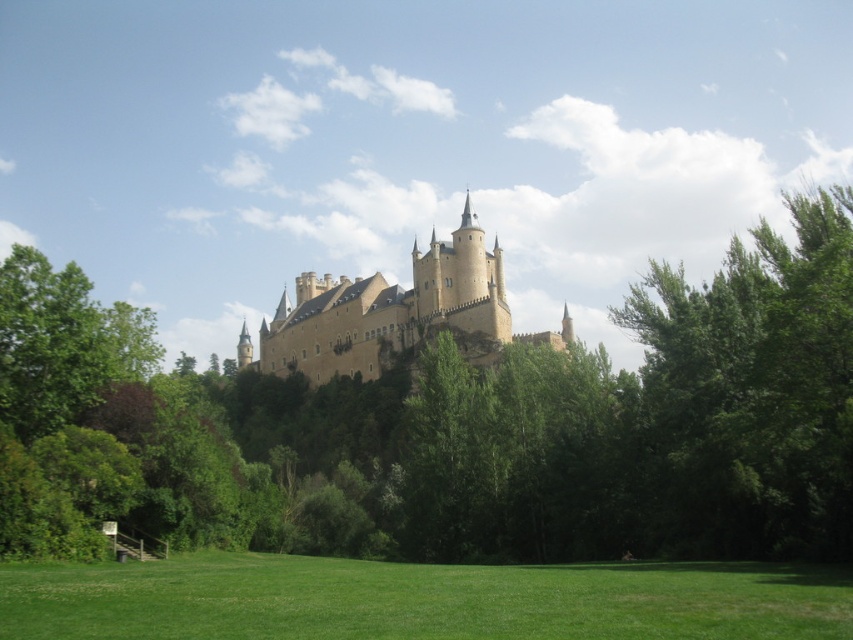
Find the location of a particular element. green leafy tree at center is located at coordinates (456, 420).

Can you confirm if green leafy tree at center is shorter than green leafy tree at right?

No, green leafy tree at center is not shorter than green leafy tree at right.

The width and height of the screenshot is (853, 640). Describe the element at coordinates (456, 420) in the screenshot. I see `green leafy tree at center` at that location.

The height and width of the screenshot is (640, 853). In order to click on green leafy tree at center in this screenshot , I will do `click(456, 420)`.

Between green leafy tree at center and brown stone castle at center, which one is positioned lower?

green leafy tree at center

Find the location of a particular element. green leafy tree at center is located at coordinates (456, 420).

Is the position of green grass at lower center less distant than that of brown stone castle at center?

Yes, green grass at lower center is in front of brown stone castle at center.

Who is more distant from viewer, (x=743, y=611) or (x=308, y=308)?

Point (x=308, y=308)

Identify the location of green grass at lower center. (421, 600).